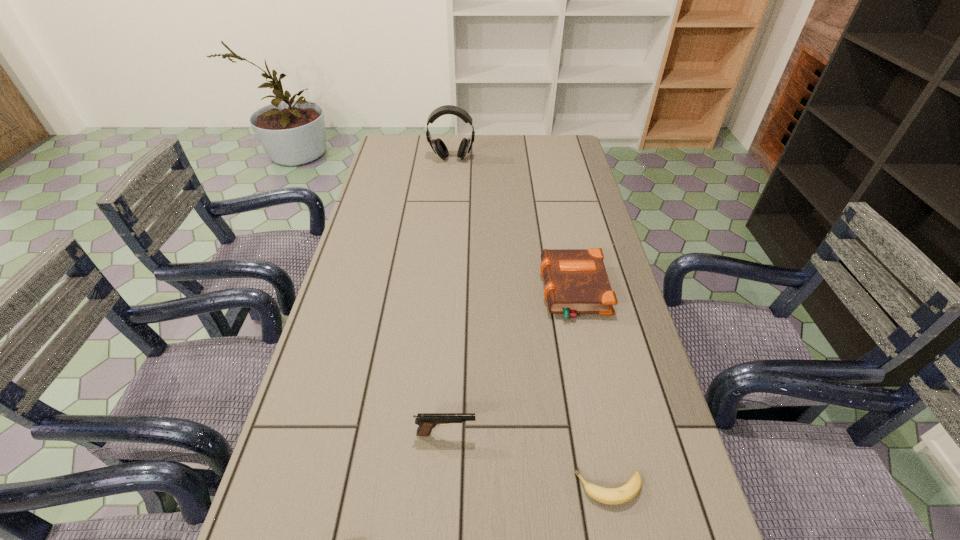
You are a GUI agent. You are given a task and a screenshot of the screen. Output one action in this format:
    pyautogui.click(x=<x>, y=<y>)
    Task: Click on the tallest object
    The image size is (960, 540).
    Given the screenshot: What is the action you would take?
    pyautogui.click(x=438, y=146)

Locate an element on the screen. The height and width of the screenshot is (540, 960). the farthest object is located at coordinates (438, 146).

Identify the location of the third farthest object. (427, 421).

You are a GUI agent. You are given a task and a screenshot of the screen. Output one action in this format:
    pyautogui.click(x=<x>, y=<y>)
    Task: Click on the pistol
    The width and height of the screenshot is (960, 540).
    Given the screenshot: What is the action you would take?
    pyautogui.click(x=427, y=421)

This screenshot has width=960, height=540. What are the coordinates of `the third tallest object` in the screenshot? It's located at tap(576, 282).

I want to click on the third nearest object, so click(576, 282).

The image size is (960, 540). I want to click on the shortest object, so click(x=613, y=496).

The height and width of the screenshot is (540, 960). In order to click on the nearest object in this screenshot , I will do `click(613, 496)`.

What are the coordinates of `vacant region located on the ear cups of the farthest object` in the screenshot? It's located at (445, 224).

What are the coordinates of `vacant space located 0.200m at the muzzle of the second tallest object` in the screenshot? It's located at (571, 433).